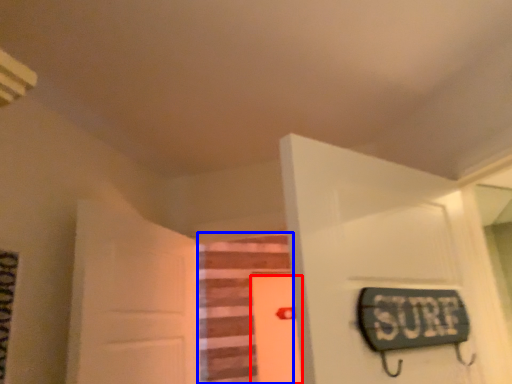
Question: Which of the following is the closest to the observer, door (highlighted by a red box) or stairwell (highlighted by a blue box)?

Choices:
 (A) door
 (B) stairwell

Answer: (B)